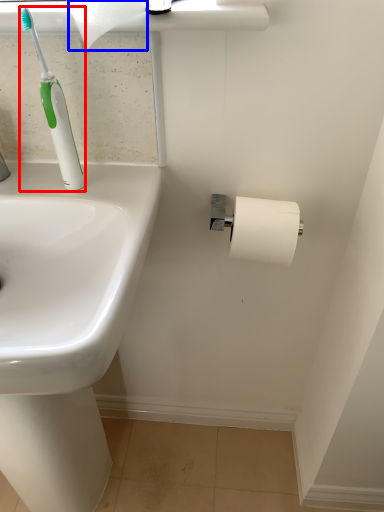
Question: Which object is further to the camera taking this photo, toilet brush (highlighted by a red box) or toilet paper (highlighted by a blue box)?

Choices:
 (A) toilet brush
 (B) toilet paper

Answer: (A)